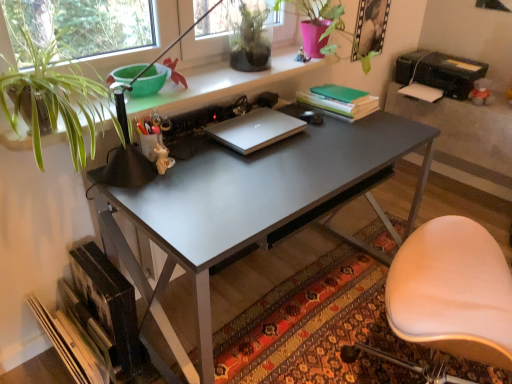
Find the location of a particular element. This screenshot has height=384, width=512. free space in front of green matte book at upper right, which is the first book from right to left is located at coordinates (351, 130).